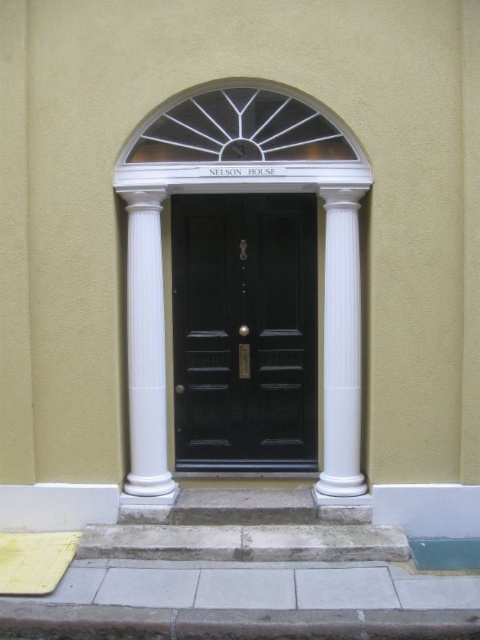
Is matte black door at center positioned in front of white smooth column at center?

No, it is not.

Is matte black door at center above white smooth column at center?

Yes.

Between point (192, 384) and point (326, 392), which one is positioned behind?

The point (192, 384) is behind.

The image size is (480, 640). In order to click on matte black door at center in this screenshot , I will do `click(244, 332)`.

Is the position of matte black door at center more distant than that of white glossy column at center?

Yes, matte black door at center is further from the viewer.

Who is lower down, matte black door at center or white glossy column at center?

white glossy column at center is below.

Does point (171, 218) come in front of point (132, 204)?

No, (171, 218) is behind (132, 204).

The image size is (480, 640). In order to click on matte black door at center in this screenshot , I will do `click(244, 332)`.

Does white glossy column at center have a smaller size compared to white smooth column at center?

No, white glossy column at center is not smaller than white smooth column at center.

Locate an element on the screen. Image resolution: width=480 pixels, height=640 pixels. white glossy column at center is located at coordinates [x=145, y=353].

Who is more distant from viewer, (146, 221) or (327, 472)?

Point (327, 472)

Locate an element on the screen. This screenshot has height=640, width=480. white glossy column at center is located at coordinates (145, 353).